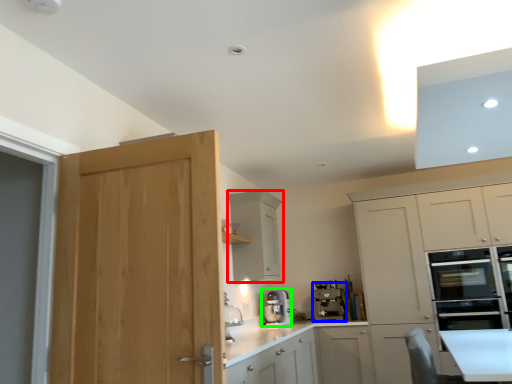
Question: Which object is the farthest from cabinetry (highlighted by a red box)? Choose among these: kitchen appliance (highlighted by a blue box) or kitchen appliance (highlighted by a green box).

Choices:
 (A) kitchen appliance
 (B) kitchen appliance

Answer: (A)